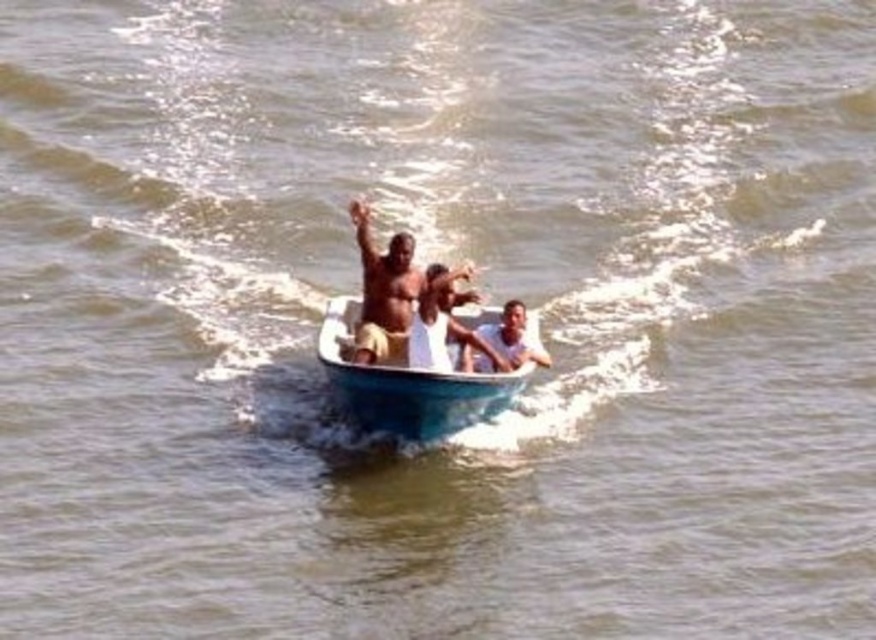
Is white plastic boat at center smaller than light brown skin at center?

No.

Is white plastic boat at center above light brown skin at center?

Actually, white plastic boat at center is below light brown skin at center.

You are a GUI agent. You are given a task and a screenshot of the screen. Output one action in this format:
    pyautogui.click(x=<x>, y=<y>)
    Task: Click on the white plastic boat at center
    This screenshot has height=640, width=876.
    Given the screenshot: What is the action you would take?
    pyautogui.click(x=407, y=385)

What are the coordinates of `white plastic boat at center` in the screenshot? It's located at (407, 385).

Does point (382, 269) lie behind point (548, 356)?

No.

Who is positioned more to the left, light brown skin at center or smooth skin man at center?

From the viewer's perspective, light brown skin at center appears more on the left side.

Between point (357, 333) and point (530, 344), which one is positioned behind?

The point (530, 344) is more distant.

Find the location of a particular element. The height and width of the screenshot is (640, 876). light brown skin at center is located at coordinates (387, 291).

Is white plastic boat at center positioned before smooth skin man at center?

Yes, white plastic boat at center is closer to the viewer.

Is point (412, 387) farther from camera compared to point (535, 353)?

No, (412, 387) is closer to viewer.

You are a GUI agent. You are given a task and a screenshot of the screen. Output one action in this format:
    pyautogui.click(x=<x>, y=<y>)
    Task: Click on the white plastic boat at center
    
    Given the screenshot: What is the action you would take?
    pyautogui.click(x=407, y=385)